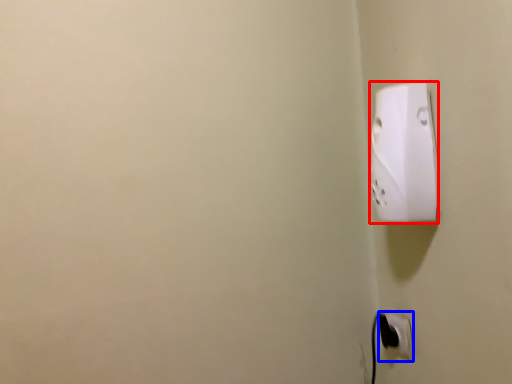
Question: Which object is closer to the camera taking this photo, power plugs and sockets (highlighted by a red box) or power plugs and sockets (highlighted by a blue box)?

Choices:
 (A) power plugs and sockets
 (B) power plugs and sockets

Answer: (A)